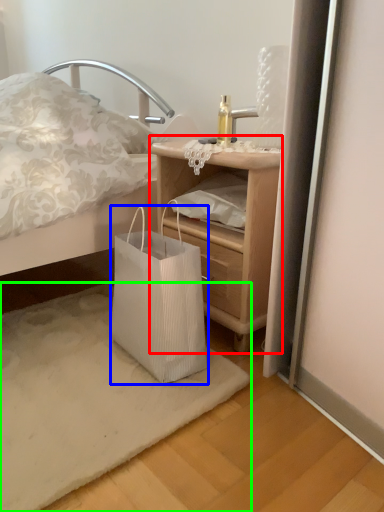
Question: Which object is positioned farthest from nightstand (highlighted by a red box)? Select from bag (highlighted by a blue box) and mat (highlighted by a green box).

Choices:
 (A) bag
 (B) mat

Answer: (B)